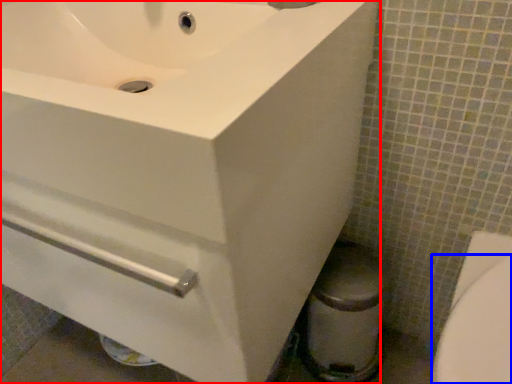
Question: Which object appears closest to the camera in this image, sink (highlighted by a red box) or bidet (highlighted by a blue box)?

Choices:
 (A) sink
 (B) bidet

Answer: (A)